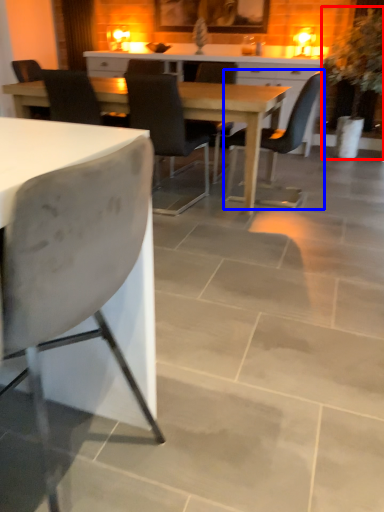
Question: Which object appears closest to the camera in this image, houseplant (highlighted by a red box) or chair (highlighted by a blue box)?

Choices:
 (A) houseplant
 (B) chair

Answer: (B)